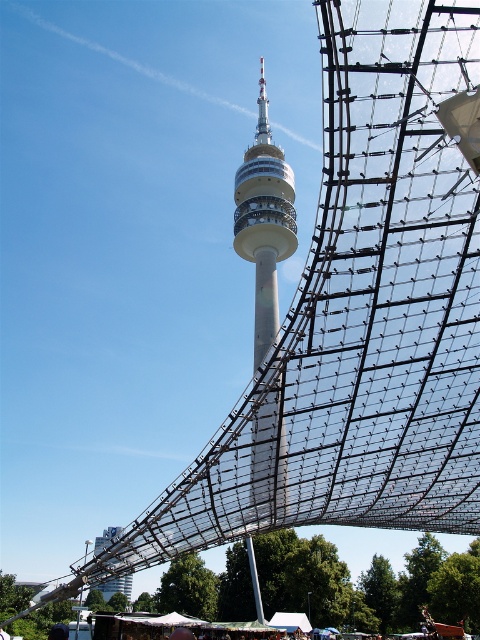
Question: Considering the relative positions of metallic mesh structure at lower center and smooth concrete tower at center in the image provided, where is metallic mesh structure at lower center located with respect to smooth concrete tower at center?

Choices:
 (A) right
 (B) left

Answer: (B)

Question: Which point is farther from the camera taking this photo?

Choices:
 (A) (454, 577)
 (B) (264, 243)

Answer: (B)

Question: Where is metallic mesh structure at lower center located in relation to smooth concrete tower at center in the image?

Choices:
 (A) above
 (B) below

Answer: (B)

Question: Is metallic mesh structure at lower center above smooth concrete tower at center?

Choices:
 (A) yes
 (B) no

Answer: (B)